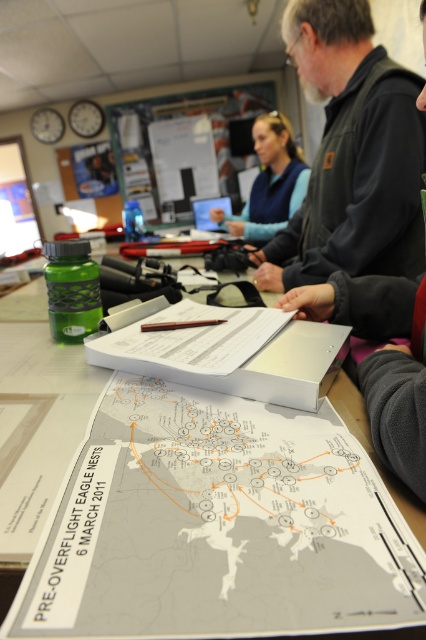
Which is above, gray fleece jacket at upper center or blue fleece vest at center?

blue fleece vest at center is above.

Who is positioned more to the left, gray fleece jacket at upper center or blue fleece vest at center?

From the viewer's perspective, blue fleece vest at center appears more on the left side.

What do you see at coordinates (357, 195) in the screenshot?
I see `gray fleece jacket at upper center` at bounding box center [357, 195].

At what (x,y) coordinates should I click in order to perform the action: click on gray fleece jacket at upper center. Please return your answer as a coordinate pair (x, y). The image size is (426, 640). Looking at the image, I should click on (357, 195).

Is point (135, 496) positioned before point (273, 205)?

Yes.

Find the location of a particular element. white paper map at center is located at coordinates (216, 525).

Locate an element on the screen. This screenshot has height=640, width=426. white paper map at center is located at coordinates (216, 525).

Is point (158, 572) in front of point (411, 198)?

That is True.

Which is below, white paper map at center or gray fleece jacket at upper center?

Positioned lower is white paper map at center.

The width and height of the screenshot is (426, 640). Describe the element at coordinates (216, 525) in the screenshot. I see `white paper map at center` at that location.

What are the coordinates of `white paper map at center` in the screenshot? It's located at (216, 525).